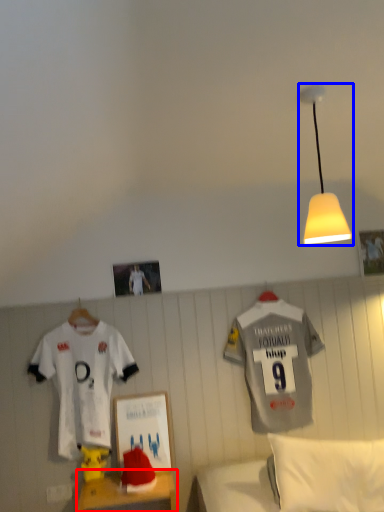
Question: Which object is closer to the camera taking this photo, furniture (highlighted by a red box) or lamp (highlighted by a blue box)?

Choices:
 (A) furniture
 (B) lamp

Answer: (B)